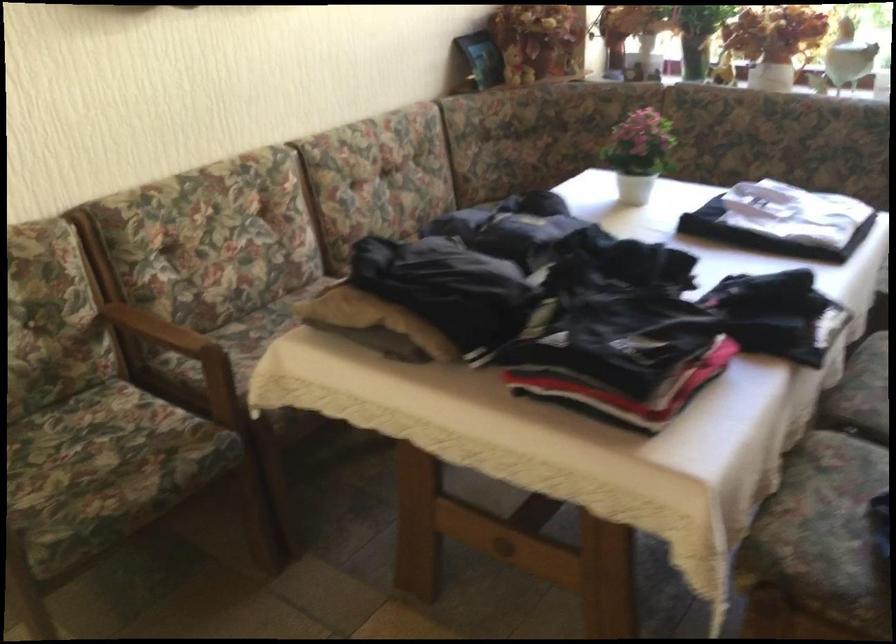
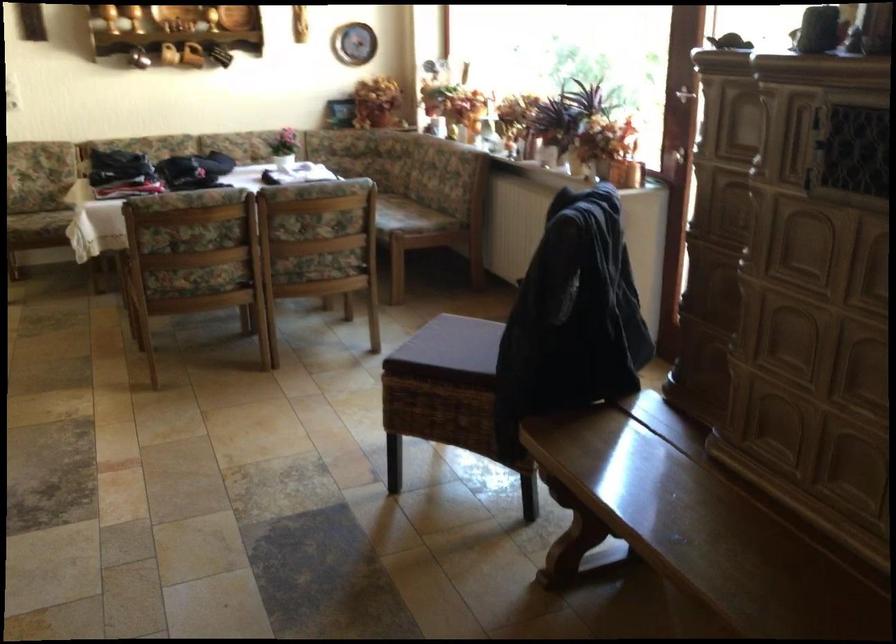
The images are taken continuously from a first-person perspective. In which direction are you moving?

The cameraman moved toward right, backward.